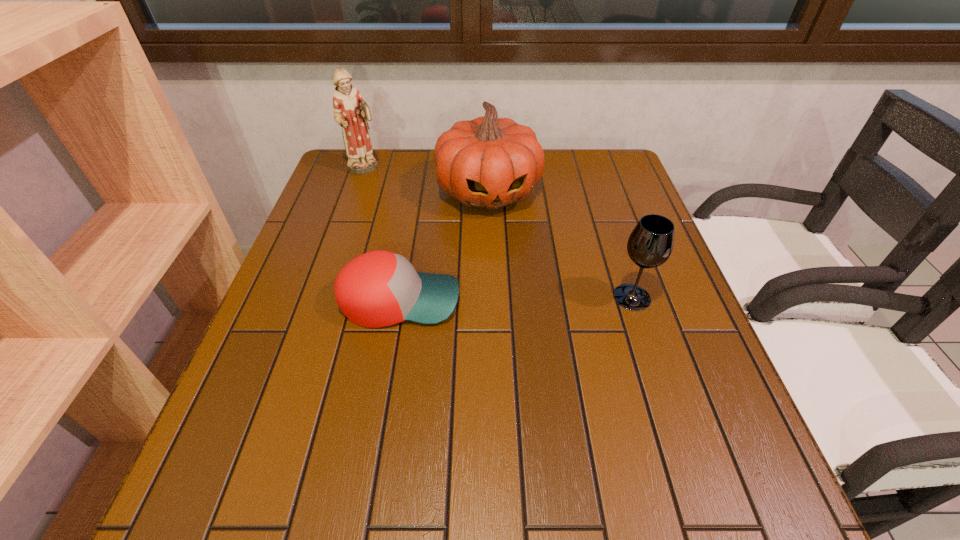
What are the coordinates of `empty space between the rightmost object and the figurine` in the screenshot? It's located at (498, 233).

Where is `free space between the figurine and the baseball cap`? The height and width of the screenshot is (540, 960). free space between the figurine and the baseball cap is located at coordinates (382, 234).

The width and height of the screenshot is (960, 540). I want to click on free space between the tallest object and the rightmost object, so click(x=498, y=233).

At what (x,y) coordinates should I click in order to perform the action: click on free area in between the wineglass and the baseball cap. Please return your answer as a coordinate pair (x, y). The width and height of the screenshot is (960, 540). Looking at the image, I should click on (516, 299).

I want to click on vacant area that lies between the tallest object and the wineglass, so click(498, 233).

The image size is (960, 540). In order to click on vacant area that lies between the tallest object and the pumpkin in this screenshot , I will do `click(426, 180)`.

I want to click on object identified as the closest to the shortest object, so (x=486, y=162).

Locate an element on the screen. object that ranks as the closest to the figurine is located at coordinates (486, 162).

Find the location of a particular element. This screenshot has width=960, height=540. free space in the image that satisfies the following two spatial constraints: 1. on the front side of the baseball cap; 2. at the brim of the tallest object is located at coordinates click(320, 300).

Identify the location of vacant region that satisfies the following two spatial constraints: 1. on the front side of the rightmost object; 2. on the right side of the figurine. (321, 297).